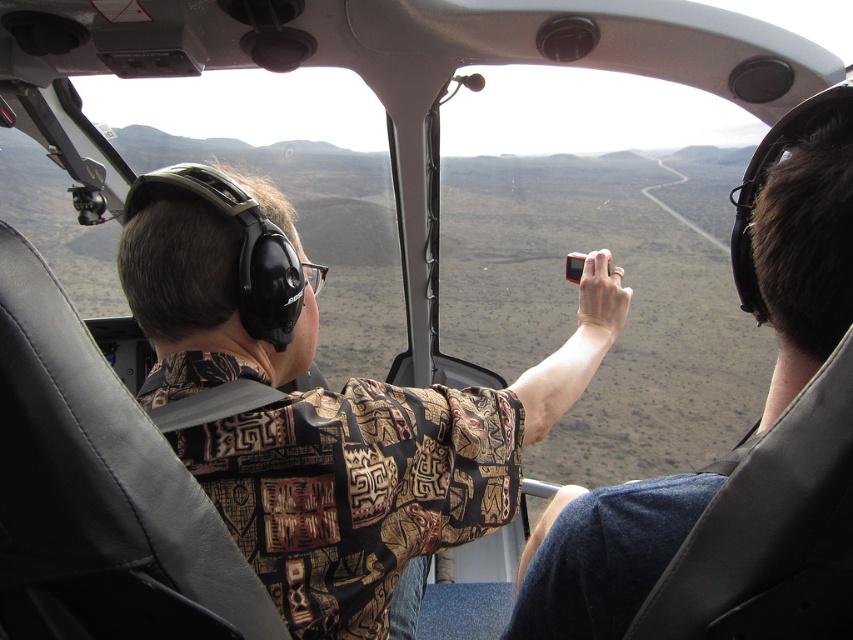
Question: Can you confirm if patterned fabric shirt at center is positioned to the left of matte black camera at right?

Choices:
 (A) yes
 (B) no

Answer: (A)

Question: Observing the image, what is the correct spatial positioning of patterned fabric shirt at center in reference to matte black camera at right?

Choices:
 (A) above
 (B) below

Answer: (A)

Question: Can you confirm if patterned fabric shirt at center is positioned to the left of matte black camera at right?

Choices:
 (A) no
 (B) yes

Answer: (B)

Question: Among these objects, which one is farthest from the camera?

Choices:
 (A) patterned fabric shirt at center
 (B) matte black camera at right

Answer: (A)